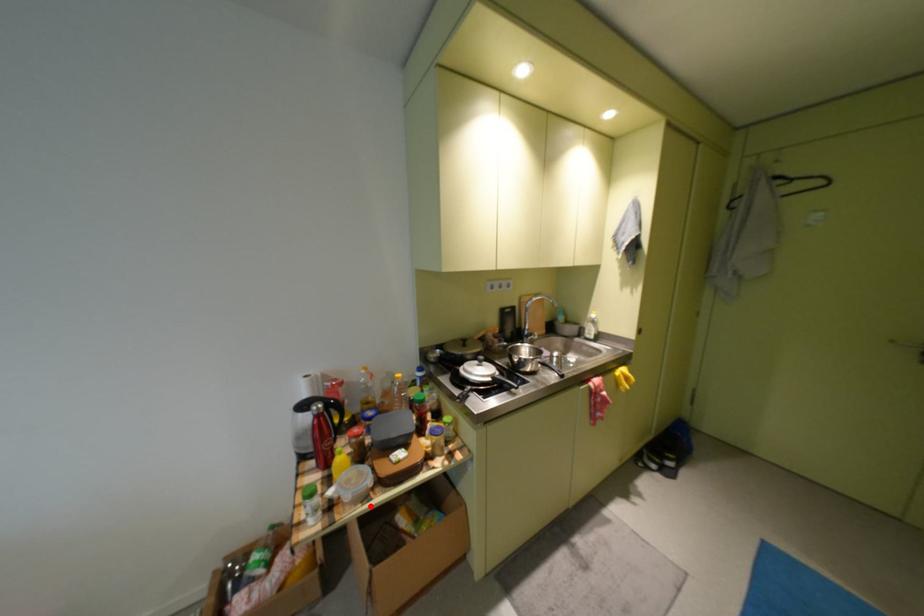
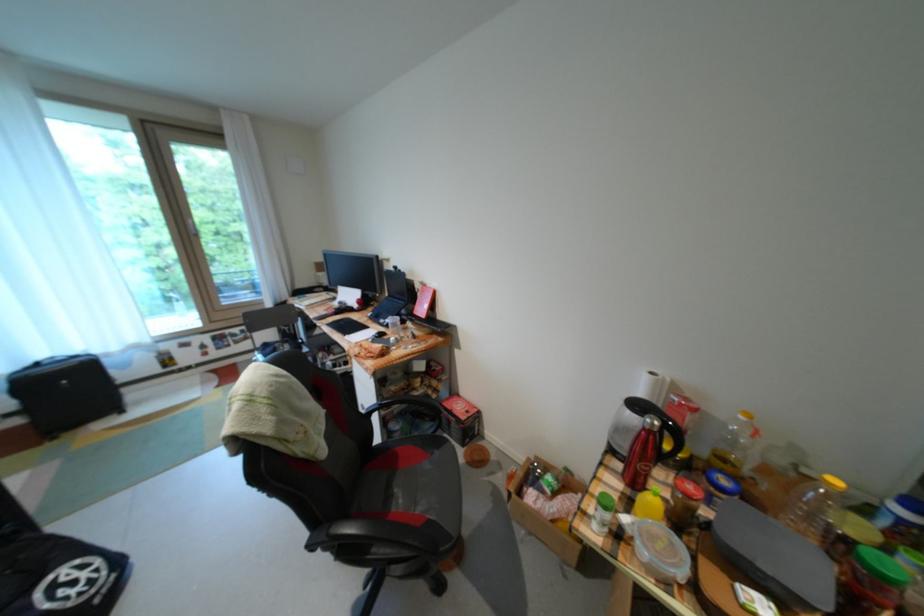
In the second image, find the point that corresponds to the highlighted location in the first image.

(664, 582)